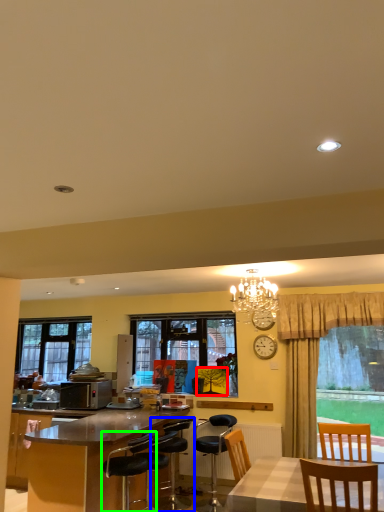
Question: Which object is positioned farthest from picture frame (highlighted by a red box)? Select from chair (highlighted by a blue box) and chair (highlighted by a green box).

Choices:
 (A) chair
 (B) chair

Answer: (B)